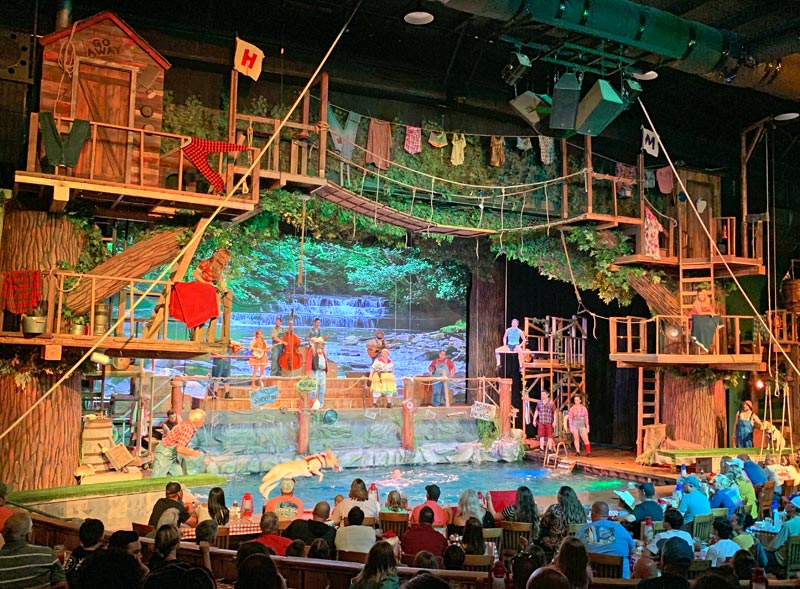
Locate an element on the screen. The image size is (800, 589). light is located at coordinates (422, 19), (526, 110), (562, 125), (589, 130), (629, 95), (760, 379), (674, 332).